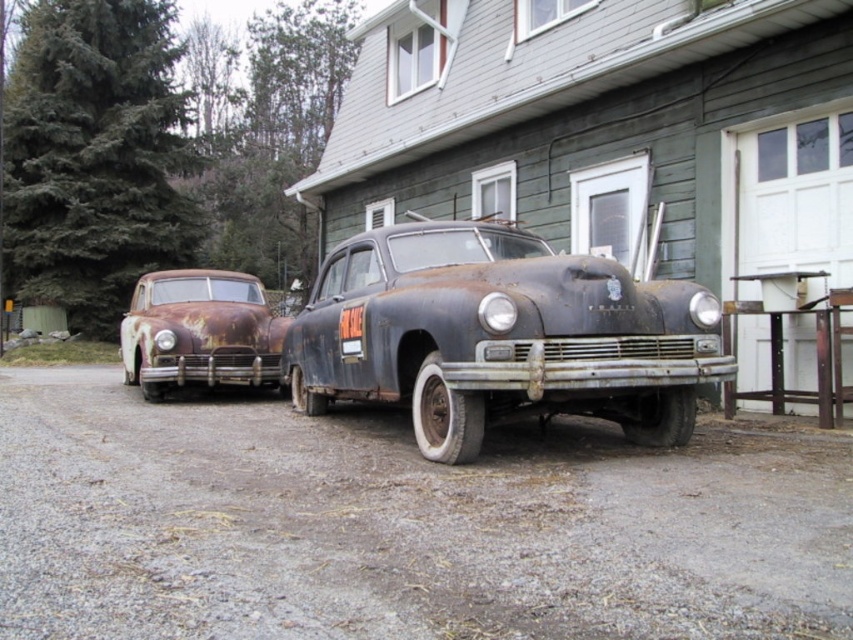
Is point (727, 488) positioned in front of point (192, 276)?

Yes, it is in front of point (192, 276).

Who is more forward, (709, 490) or (281, 339)?

Positioned in front is point (709, 490).

Identify the location of rusty gravel driveway at lower center. (401, 525).

Locate an element on the screen. rusty gravel driveway at lower center is located at coordinates (401, 525).

I want to click on rusty metal car at center, so click(498, 336).

Which of these two, rusty metal car at center or rusty metal car at left, stands taller?

With more height is rusty metal car at left.

Is point (422, 344) positioned behind point (140, 282)?

No, (422, 344) is closer to viewer.

This screenshot has width=853, height=640. I want to click on rusty metal car at center, so click(498, 336).

Does point (527, 472) come behind point (680, 364)?

No, (527, 472) is in front of (680, 364).

Does rusty gravel driveway at lower center have a lesser width compared to rusty metal car at center?

Incorrect, rusty gravel driveway at lower center's width is not less than rusty metal car at center's.

You are a GUI agent. You are given a task and a screenshot of the screen. Output one action in this format:
    pyautogui.click(x=<x>, y=<y>)
    Task: Click on the rusty gravel driveway at lower center
    
    Given the screenshot: What is the action you would take?
    pyautogui.click(x=401, y=525)